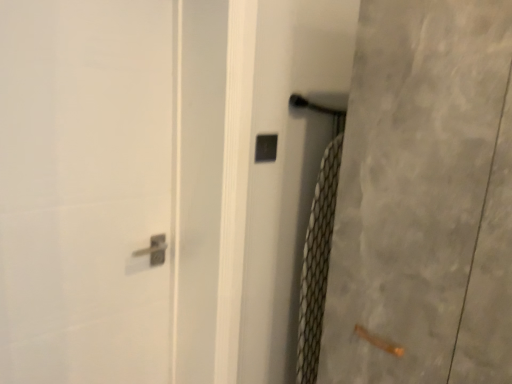
Question: From a real-world perspective, is clear plastic screen door at center, the 2th screen door from the right, under black plastic lock at center?

Choices:
 (A) yes
 (B) no

Answer: (A)

Question: Are clear plastic screen door at center, the 2th screen door from the right, and black plastic lock at center beside each other?

Choices:
 (A) yes
 (B) no

Answer: (B)

Question: Can you confirm if clear plastic screen door at center, the 2th screen door from the right, is taller than black plastic lock at center?

Choices:
 (A) no
 (B) yes

Answer: (B)

Question: Is clear plastic screen door at center, the 2th screen door from the right, shorter than black plastic lock at center?

Choices:
 (A) yes
 (B) no

Answer: (B)

Question: Does clear plastic screen door at center, the 2th screen door when ordered from left to right, have a greater width compared to black plastic lock at center?

Choices:
 (A) no
 (B) yes

Answer: (B)

Question: From the image's perspective, is clear plastic screen door at center, the 2th screen door from the right, above black plastic lock at center?

Choices:
 (A) yes
 (B) no

Answer: (B)

Question: From the image's perspective, is white glossy door handle at upper center, which is counted as the third screen door, starting from the right, beneath black plastic lock at center?

Choices:
 (A) yes
 (B) no

Answer: (A)

Question: Are white glossy door handle at upper center, arranged as the first screen door when viewed from the left, and black plastic lock at center located far from each other?

Choices:
 (A) yes
 (B) no

Answer: (B)

Question: From a real-world perspective, is white glossy door handle at upper center, which is counted as the third screen door, starting from the right, physically below black plastic lock at center?

Choices:
 (A) yes
 (B) no

Answer: (A)

Question: Does white glossy door handle at upper center, which is counted as the third screen door, starting from the right, have a larger size compared to black plastic lock at center?

Choices:
 (A) yes
 (B) no

Answer: (A)

Question: Is white glossy door handle at upper center, arranged as the first screen door when viewed from the left, at the right side of black plastic lock at center?

Choices:
 (A) no
 (B) yes

Answer: (A)

Question: Can you confirm if white glossy door handle at upper center, arranged as the first screen door when viewed from the left, is thinner than black plastic lock at center?

Choices:
 (A) yes
 (B) no

Answer: (B)

Question: Considering the relative positions of white glossy door handle at upper center, arranged as the first screen door when viewed from the left, and clear plastic screen door at center, the 2th screen door when ordered from left to right, in the image provided, is white glossy door handle at upper center, arranged as the first screen door when viewed from the left, to the right of clear plastic screen door at center, the 2th screen door when ordered from left to right, from the viewer's perspective?

Choices:
 (A) no
 (B) yes

Answer: (A)